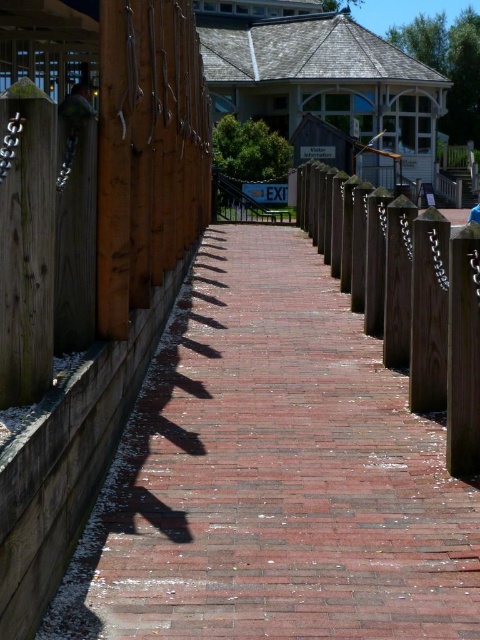
Between point (212, 445) and point (456, 243), which one is positioned behind?

Point (212, 445)

Does red brick path at center have a lesser width compared to wooden post at center?

Incorrect, red brick path at center's width is not less than wooden post at center's.

Is point (448, 620) farther from camera compared to point (377, 237)?

No, it is in front of (377, 237).

Where is `red brick path at center`? This screenshot has height=640, width=480. red brick path at center is located at coordinates (273, 476).